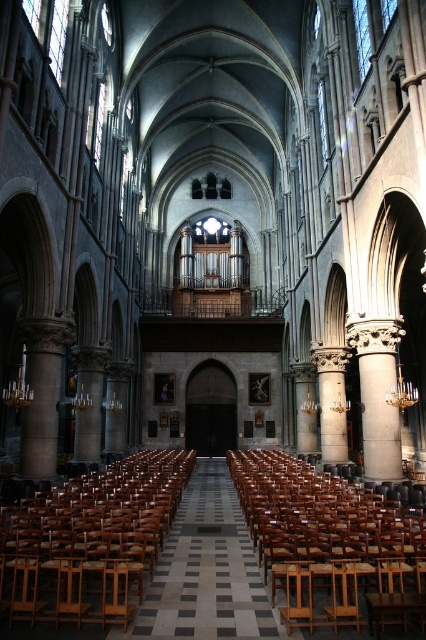
Question: Which is nearer to the smooth stone column at left?

Choices:
 (A) wooden polished chair at center
 (B) wooden chair at center

Answer: (B)

Question: Can you confirm if wooden polished chair at center is thinner than wooden chair at center?

Choices:
 (A) yes
 (B) no

Answer: (B)

Question: Does wooden polished chair at center have a greater width compared to wooden chair at center?

Choices:
 (A) yes
 (B) no

Answer: (A)

Question: Does wooden polished chair at center come in front of wooden chair at center?

Choices:
 (A) yes
 (B) no

Answer: (A)

Question: Which point appears closest to the camera in this image?

Choices:
 (A) (55, 444)
 (B) (69, 570)
 (C) (342, 588)

Answer: (B)

Question: Which object is farther from the camera taking this photo?

Choices:
 (A) smooth stone column at left
 (B) wooden polished chair at center

Answer: (A)